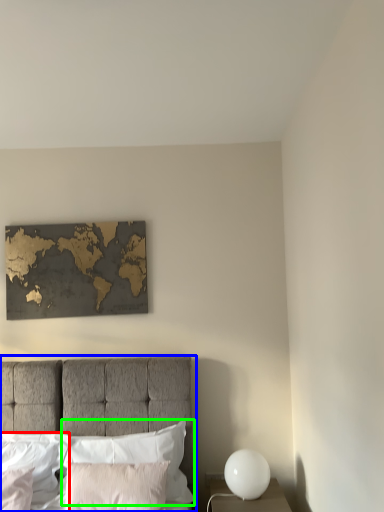
Question: Estimate the real-world distances between objects in this image. Which object is closer to pillow (highlighted by a red box), bed (highlighted by a blue box) or pillow (highlighted by a green box)?

Choices:
 (A) bed
 (B) pillow

Answer: (B)